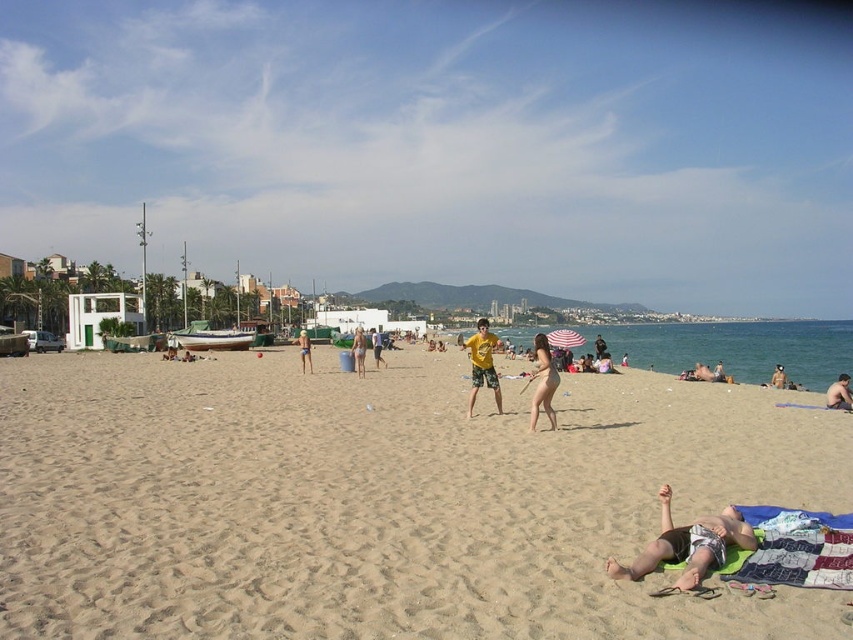
You are standing on the beach and see the tan skin person at lower right and the nude skin at center. Which person is closer to the water?

The tan skin person at lower right is closer to the water because they are positioned below the nude skin at center, which is higher up on the beach.

You are a drone operator trying to capture a photo of the beach scene. The drone is currently at the point marked as point (444, 144). What is the primary visible object at that location?

The point (444, 144) indicates transparent blue sky at upper center, so the primary visible object at that location is the transparent blue sky at upper center.